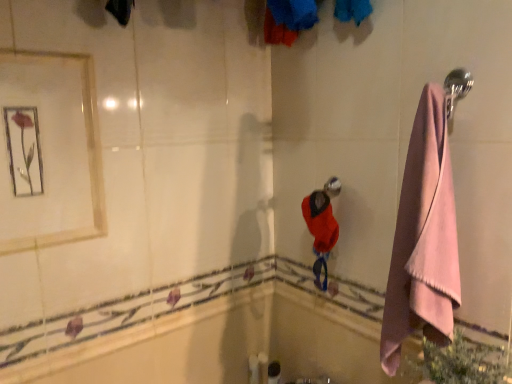
Question: Is satin silver shower head at center in front of or behind metallic framed mirror at upper left in the image?

Choices:
 (A) behind
 (B) front

Answer: (A)

Question: Is satin silver shower head at center inside the boundaries of metallic framed mirror at upper left, or outside?

Choices:
 (A) inside
 (B) outside

Answer: (B)

Question: Considering the real-world distances, which object is closest to the metallic framed mirror at upper left?

Choices:
 (A) white glossy bath at lower left
 (B) pink fabric towel at right
 (C) satin silver shower head at center

Answer: (A)

Question: Which object is positioned farthest from the white glossy bath at lower left?

Choices:
 (A) pink fabric towel at right
 (B) satin silver shower head at center
 (C) metallic framed mirror at upper left

Answer: (B)